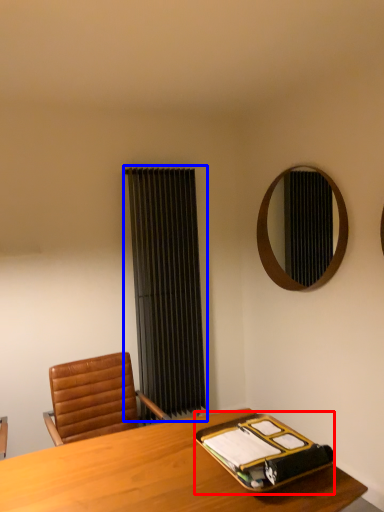
Question: Which of the following is the closest to the observer, binder (highlighted by a red box) or curtain (highlighted by a blue box)?

Choices:
 (A) binder
 (B) curtain

Answer: (A)